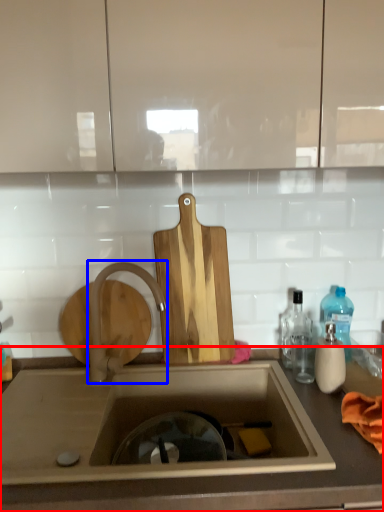
Question: Which object is closer to the camera taking this photo, countertop (highlighted by a red box) or tap (highlighted by a blue box)?

Choices:
 (A) countertop
 (B) tap

Answer: (A)